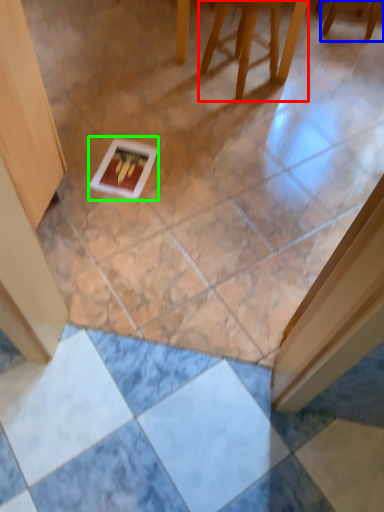
Question: Considering the real-world distances, which object is closest to furniture (highlighted by a red box)? furniture (highlighted by a blue box) or postcard (highlighted by a green box).

Choices:
 (A) furniture
 (B) postcard

Answer: (A)